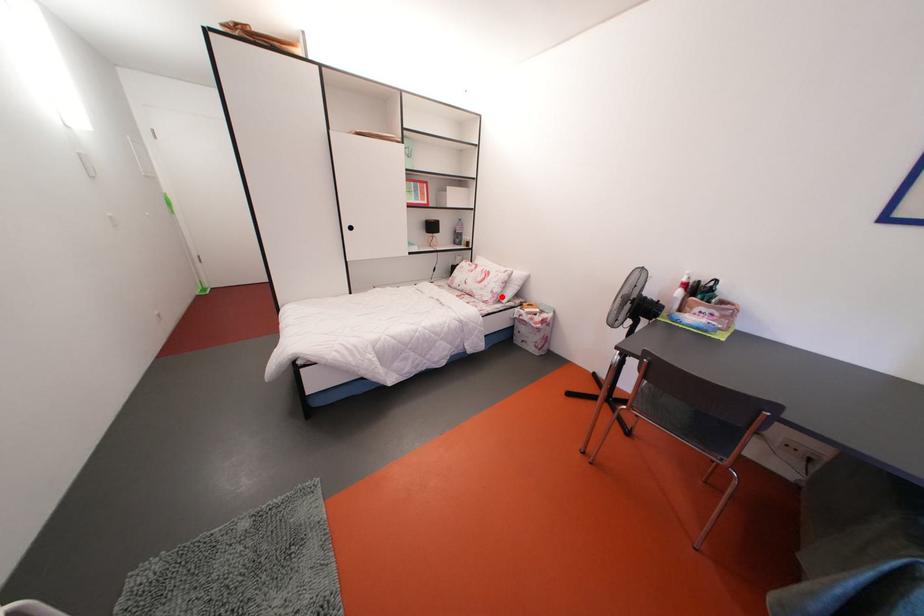
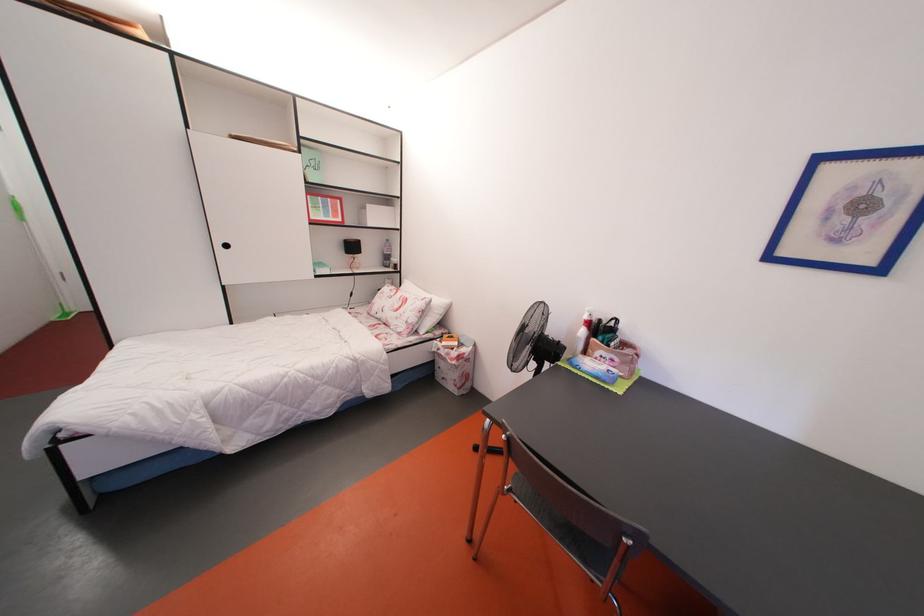
In the second image, find the point that corresponds to the highlighted location in the first image.

(417, 326)